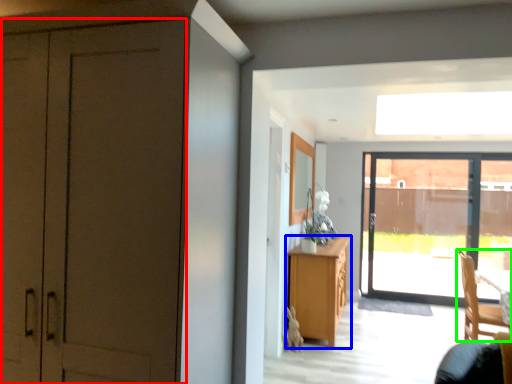
Question: Which is nearer to the door (highlighted by a red box)? cabinetry (highlighted by a blue box) or chair (highlighted by a green box).

Choices:
 (A) cabinetry
 (B) chair

Answer: (A)